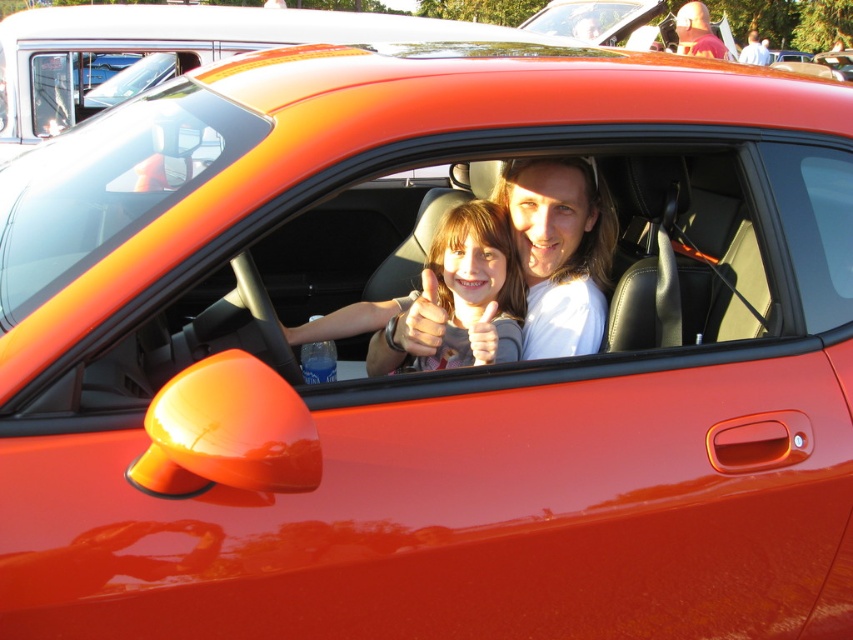
Is matte white shirt at center taller than matte pink sweater at center?

Correct, matte white shirt at center is much taller as matte pink sweater at center.

Which is behind, point (596, 218) or point (445, 336)?

Positioned behind is point (596, 218).

Locate an element on the screen. The image size is (853, 640). matte white shirt at center is located at coordinates (x=560, y=252).

Where is `matte white shirt at center`? The image size is (853, 640). matte white shirt at center is located at coordinates pyautogui.click(x=560, y=252).